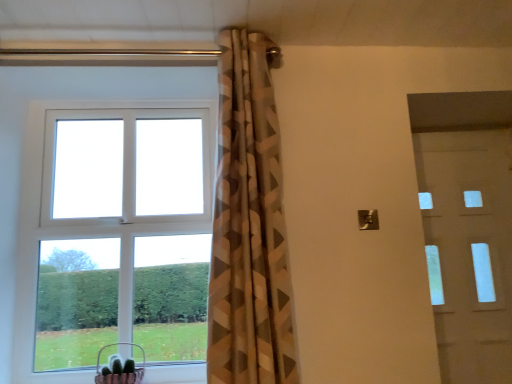
This screenshot has width=512, height=384. What do you see at coordinates (103, 207) in the screenshot?
I see `white plastic window at upper left` at bounding box center [103, 207].

Identify the location of white plastic window at upper left. (103, 207).

I want to click on metallic pink basket at lower left, so click(120, 371).

In order to click on white glossy door at right in this screenshot , I will do `click(469, 249)`.

This screenshot has height=384, width=512. I want to click on geometric-patterned curtain at center, so click(249, 224).

Is white glossy door at right located outside metallic pink basket at lower left?

Indeed, white glossy door at right is completely outside metallic pink basket at lower left.

In the image, is white glossy door at right positioned in front of or behind metallic pink basket at lower left?

Clearly, white glossy door at right is behind metallic pink basket at lower left.

Does point (429, 163) come in front of point (130, 378)?

No, (429, 163) is further to viewer.

Is white glossy door at right positioned with its back to metallic pink basket at lower left?

No, metallic pink basket at lower left is not at the back of white glossy door at right.

Is geometric-patterned curtain at center surrounding metallic pink basket at lower left?

No, metallic pink basket at lower left is not a part of geometric-patterned curtain at center.

Is geometric-patterned curtain at center taller or shorter than metallic pink basket at lower left?

geometric-patterned curtain at center is taller than metallic pink basket at lower left.

Which of these two, geometric-patterned curtain at center or metallic pink basket at lower left, is bigger?

geometric-patterned curtain at center is bigger.

Is geometric-patterned curtain at center turned away from metallic pink basket at lower left?

geometric-patterned curtain at center does not have its back to metallic pink basket at lower left.

Considering the relative positions of metallic pink basket at lower left and white plastic window at upper left in the image provided, is metallic pink basket at lower left behind white plastic window at upper left?

No, metallic pink basket at lower left is in front of white plastic window at upper left.

From a real-world perspective, which is physically below, metallic pink basket at lower left or white plastic window at upper left?

metallic pink basket at lower left is physically lower.

Is metallic pink basket at lower left not close to white plastic window at upper left?

That's not correct — metallic pink basket at lower left is a little close to white plastic window at upper left.

Visually, is metallic pink basket at lower left positioned to the left or to the right of white plastic window at upper left?

In the image, metallic pink basket at lower left appears on the right side of white plastic window at upper left.

In the scene shown: How different are the orientations of geometric-patterned curtain at center and white glossy door at right in degrees?

The facing directions of geometric-patterned curtain at center and white glossy door at right are 2.26 degrees apart.

Which object is positioned more to the left, geometric-patterned curtain at center or white glossy door at right?

From the viewer's perspective, geometric-patterned curtain at center appears more on the left side.

Could you tell me if geometric-patterned curtain at center is turned towards white glossy door at right?

No, geometric-patterned curtain at center is not oriented towards white glossy door at right.

Consider the image. Considering the sizes of objects geometric-patterned curtain at center and white glossy door at right in the image provided, who is shorter, geometric-patterned curtain at center or white glossy door at right?

Standing shorter between the two is white glossy door at right.

Is metallic pink basket at lower left not within white glossy door at right?

Absolutely, metallic pink basket at lower left is external to white glossy door at right.

In terms of height, does metallic pink basket at lower left look taller or shorter compared to white glossy door at right?

Considering their sizes, metallic pink basket at lower left has less height than white glossy door at right.

Is metallic pink basket at lower left closer to camera compared to white glossy door at right?

Yes, it is in front of white glossy door at right.

Image resolution: width=512 pixels, height=384 pixels. Find the location of `door above the metallic pink basket at lower left (from the image's perspective)`. door above the metallic pink basket at lower left (from the image's perspective) is located at coordinates (469, 249).

Considering the relative positions of white glossy door at right and white plastic window at upper left in the image provided, is white glossy door at right to the left of white plastic window at upper left from the viewer's perspective?

No.

From a real-world perspective, between white glossy door at right and white plastic window at upper left, who is vertically higher?

white plastic window at upper left is physically above.

Does white glossy door at right turn towards white plastic window at upper left?

No, white glossy door at right is not aimed at white plastic window at upper left.

Is white plastic window at upper left in contact with white glossy door at right?

white plastic window at upper left is not next to white glossy door at right, and they're not touching.

From the picture: Considering the relative sizes of white plastic window at upper left and white glossy door at right in the image provided, is white plastic window at upper left shorter than white glossy door at right?

Yes, white plastic window at upper left is shorter than white glossy door at right.

In the scene shown: From the image's perspective, is white plastic window at upper left located above white glossy door at right?

Correct, white plastic window at upper left appears higher than white glossy door at right in the image.

Does white plastic window at upper left appear on the right side of white glossy door at right?

No.

Locate an element on the screen. door that appears on the right of metallic pink basket at lower left is located at coordinates (469, 249).

Where is `curtain above the metallic pink basket at lower left (from a real-world perspective)`? curtain above the metallic pink basket at lower left (from a real-world perspective) is located at coordinates (249, 224).

From the image, which object appears to be farther from geometric-patterned curtain at center, white plastic window at upper left or white glossy door at right?

white glossy door at right is positioned further to the anchor geometric-patterned curtain at center.

When comparing their distances from geometric-patterned curtain at center, does white plastic window at upper left or metallic pink basket at lower left seem further?

metallic pink basket at lower left is further to geometric-patterned curtain at center.

Based on their spatial positions, is metallic pink basket at lower left or white glossy door at right further from white plastic window at upper left?

white glossy door at right lies further to white plastic window at upper left than the other object.

From the image, which object appears to be farther from metallic pink basket at lower left, white plastic window at upper left or geometric-patterned curtain at center?

Result: The object further to metallic pink basket at lower left is geometric-patterned curtain at center.

From the image, which object appears to be nearer to white plastic window at upper left, metallic pink basket at lower left or geometric-patterned curtain at center?

metallic pink basket at lower left is positioned closer to the anchor white plastic window at upper left.

Considering their positions, is geometric-patterned curtain at center positioned closer to metallic pink basket at lower left than white plastic window at upper left?

white plastic window at upper left lies closer to metallic pink basket at lower left than the other object.

Looking at the image, which one is located closer to white glossy door at right, metallic pink basket at lower left or geometric-patterned curtain at center?

Based on the image, geometric-patterned curtain at center appears to be nearer to white glossy door at right.

When comparing their distances from geometric-patterned curtain at center, does white glossy door at right or metallic pink basket at lower left seem further?

white glossy door at right is positioned further to the anchor geometric-patterned curtain at center.

At what (x,y) coordinates should I click in order to perform the action: click on curtain located between metallic pink basket at lower left and white glossy door at right in the left-right direction. Please return your answer as a coordinate pair (x, y). This screenshot has width=512, height=384. Looking at the image, I should click on (249, 224).

Find the location of a particular element. The image size is (512, 384). basket located between white plastic window at upper left and white glossy door at right in the left-right direction is located at coordinates (x=120, y=371).

Image resolution: width=512 pixels, height=384 pixels. I want to click on window between geometric-patterned curtain at center and metallic pink basket at lower left from top to bottom, so click(x=103, y=207).

Find the location of a particular element. Image resolution: width=512 pixels, height=384 pixels. curtain between white plastic window at upper left and white glossy door at right in the horizontal direction is located at coordinates (249, 224).